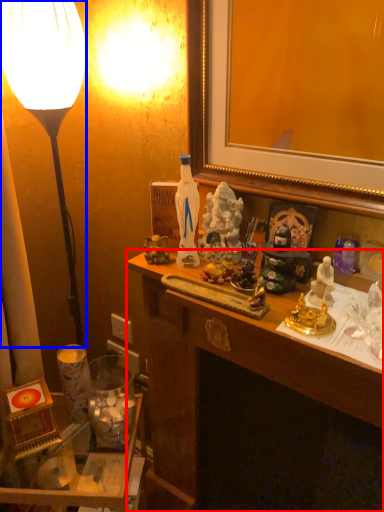
Question: Which object is closer to the camera taking this photo, desk (highlighted by a red box) or lamp (highlighted by a blue box)?

Choices:
 (A) desk
 (B) lamp

Answer: (A)